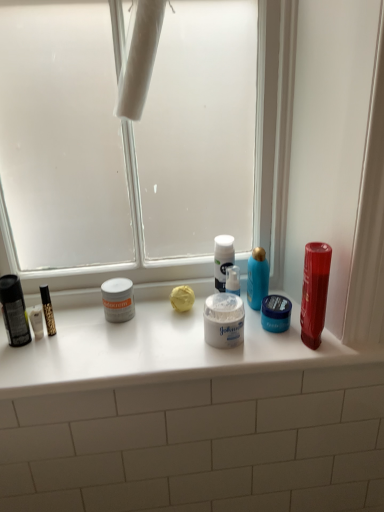
Question: From the image's perspective, is white matte counter at center below shiny plastic mouthwash at right?

Choices:
 (A) yes
 (B) no

Answer: (A)

Question: Considering the relative sizes of white matte counter at center and shiny plastic mouthwash at right in the image provided, is white matte counter at center smaller than shiny plastic mouthwash at right?

Choices:
 (A) yes
 (B) no

Answer: (B)

Question: From a real-world perspective, is white matte counter at center under shiny plastic mouthwash at right?

Choices:
 (A) yes
 (B) no

Answer: (A)

Question: Does white matte counter at center have a larger size compared to shiny plastic mouthwash at right?

Choices:
 (A) no
 (B) yes

Answer: (B)

Question: Is white matte counter at center thinner than shiny plastic mouthwash at right?

Choices:
 (A) no
 (B) yes

Answer: (A)

Question: Do you think transparent glass window screen at center is within white matte counter at center, or outside of it?

Choices:
 (A) outside
 (B) inside

Answer: (A)

Question: Is transparent glass window screen at center to the left or to the right of white matte counter at center in the image?

Choices:
 (A) right
 (B) left

Answer: (B)

Question: From the image's perspective, relative to white matte counter at center, is transparent glass window screen at center above or below?

Choices:
 (A) above
 (B) below

Answer: (A)

Question: Considering the positions of transparent glass window screen at center and white matte counter at center in the image, is transparent glass window screen at center taller or shorter than white matte counter at center?

Choices:
 (A) tall
 (B) short

Answer: (A)

Question: Is shiny plastic mouthwash at right inside or outside of blue matte jar at center, which is the first toiletry in right-to-left order?

Choices:
 (A) inside
 (B) outside

Answer: (B)

Question: From the image's perspective, is shiny plastic mouthwash at right located above or below blue matte jar at center, the 2th toiletry viewed from the left?

Choices:
 (A) below
 (B) above

Answer: (B)

Question: From a real-world perspective, is shiny plastic mouthwash at right physically located above or below blue matte jar at center, which is the first toiletry in right-to-left order?

Choices:
 (A) above
 (B) below

Answer: (A)

Question: Considering the positions of shiny plastic mouthwash at right and blue matte jar at center, which is the first toiletry in right-to-left order, in the image, is shiny plastic mouthwash at right taller or shorter than blue matte jar at center, which is the first toiletry in right-to-left order,?

Choices:
 (A) tall
 (B) short

Answer: (A)

Question: Is white matte jar at center, positioned as the second toiletry in right-to-left order, in front of or behind white matte jar at center in the image?

Choices:
 (A) behind
 (B) front

Answer: (A)

Question: From a real-world perspective, is white matte jar at center, marked as the 1th toiletry in a left-to-right arrangement, physically located above or below white matte jar at center?

Choices:
 (A) above
 (B) below

Answer: (B)